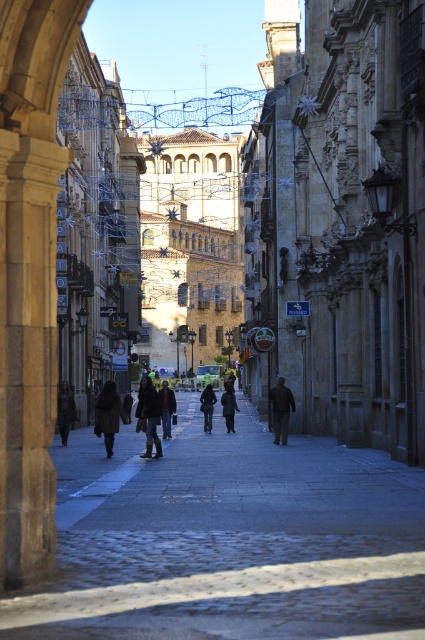
Question: Is cobblestone pavement at center positioned behind dark brown leather coat at center?

Choices:
 (A) yes
 (B) no

Answer: (B)

Question: Among these objects, which one is farthest from the camera?

Choices:
 (A) dark gray coat at center
 (B) dark gray fabric coat at center

Answer: (B)

Question: Can you confirm if dark brown leather coat at center is wider than dark gray coat at center?

Choices:
 (A) yes
 (B) no

Answer: (B)

Question: Is dark brown leather coat at center wider than dark gray jeans at center?

Choices:
 (A) no
 (B) yes

Answer: (A)

Question: Estimate the real-world distances between objects in this image. Which object is farther from the dark brown leather jacket at center?

Choices:
 (A) dark gray jeans at center
 (B) dark gray fabric coat at center
 (C) cobblestone pavement at center
 (D) dark brown coat at center

Answer: (B)

Question: Which of these objects is positioned closest to the dark gray coat at center?

Choices:
 (A) dark brown coat at center
 (B) dark blue jacket at center
 (C) dark brown leather coat at center
 (D) dark gray fabric coat at center

Answer: (D)